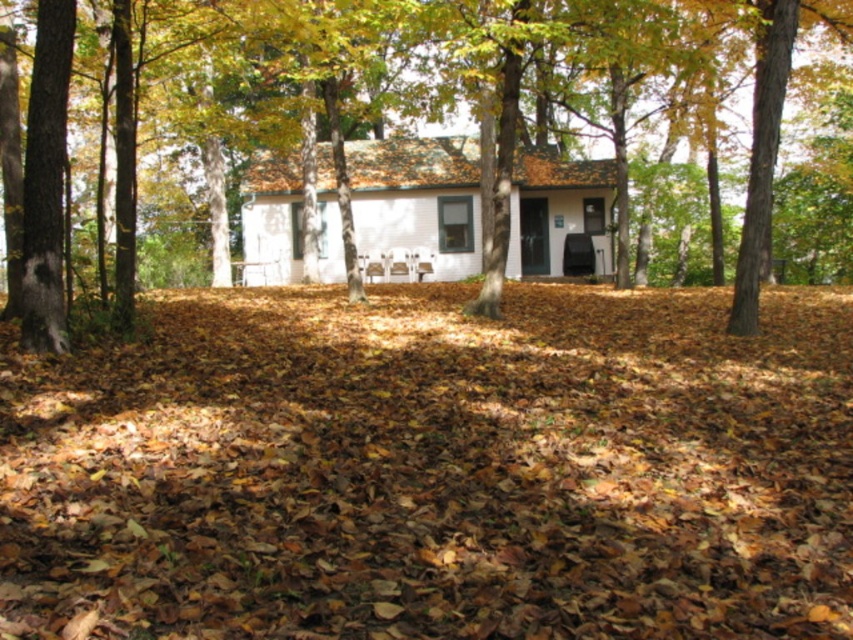
You are standing in front of the autumn scene with the white house. There are two points marked on the image, one at coordinates point (508,403) and another at point (122,99). Which of these points is nearer to your current position?

Point (508,403) is closer to the camera than point (122,99), so the point at coordinates point (508,403) is nearer to your current position.

You are standing in front of the small white house and notice two elements at the center of the image. Which one is larger between the brown leaf litter at center and the brown wood tree at center?

The brown wood tree at center is larger than the brown leaf litter at center.